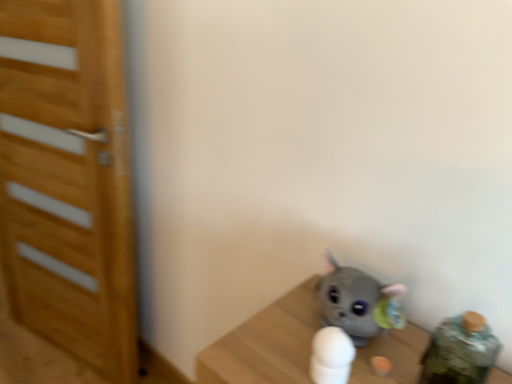
Question: From the image's perspective, relative to white matte toy at center, is wooden door at left above or below?

Choices:
 (A) above
 (B) below

Answer: (A)

Question: From their relative heights in the image, would you say wooden door at left is taller or shorter than white matte toy at center?

Choices:
 (A) short
 (B) tall

Answer: (B)

Question: Looking at the image, does wooden door at left seem bigger or smaller compared to white matte toy at center?

Choices:
 (A) big
 (B) small

Answer: (A)

Question: Based on their positions, is white matte toy at center located to the left or right of wooden door at left?

Choices:
 (A) right
 (B) left

Answer: (A)

Question: Is white matte toy at center in front of or behind wooden door at left in the image?

Choices:
 (A) behind
 (B) front

Answer: (B)

Question: Considering the positions of point (340, 359) and point (29, 117), is point (340, 359) closer or farther from the camera than point (29, 117)?

Choices:
 (A) farther
 (B) closer

Answer: (B)

Question: Looking at the image, does white matte toy at center seem bigger or smaller compared to wooden door at left?

Choices:
 (A) big
 (B) small

Answer: (B)